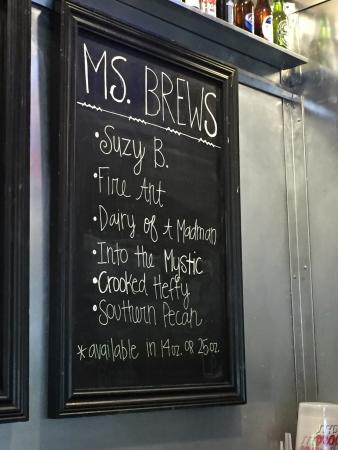
Locate an element on the screen. wall is located at coordinates (273, 265).